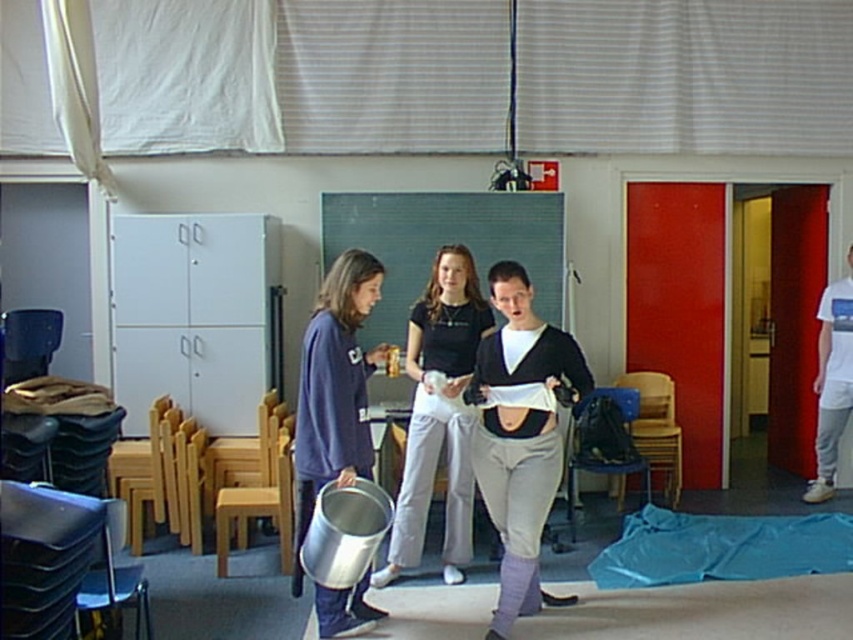
You are standing in the classroom and want to move from point A to point B. Point A is at coordinate point (494, 349) and point B is at coordinate point (370, 364). Which point is closer to you when you start at point A?

Point A at coordinate point (494, 349) is closer to you than point B at coordinate point (370, 364) because it is the starting point.

You are organizing a clothing donation drive and need to place the matte black sweater at center and the matte black shirt at center into boxes. The boxes are 60 centimeters wide. Can both items fit side by side in the same box without overlapping?

The matte black sweater at center is 59.37 centimeters from matte black shirt at center, so yes, both items can fit side by side in the same box since the total distance between them is less than the box width of 60 centimeters.

You are organizing a classroom cleanup and need to place the matte black sweater at center and the blue fabric tarp at lower right. According to the scene, which object is positioned to the left of the other?

The matte black sweater at center is to the left of the blue fabric tarp at lower right.